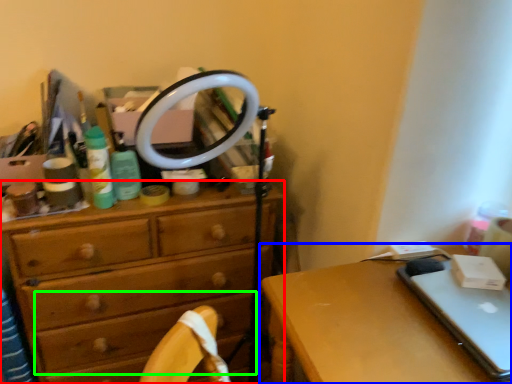
Question: Which is farther away from chest of drawers (highlighted by a red box)? desk (highlighted by a blue box) or drawer (highlighted by a green box)?

Choices:
 (A) desk
 (B) drawer

Answer: (A)